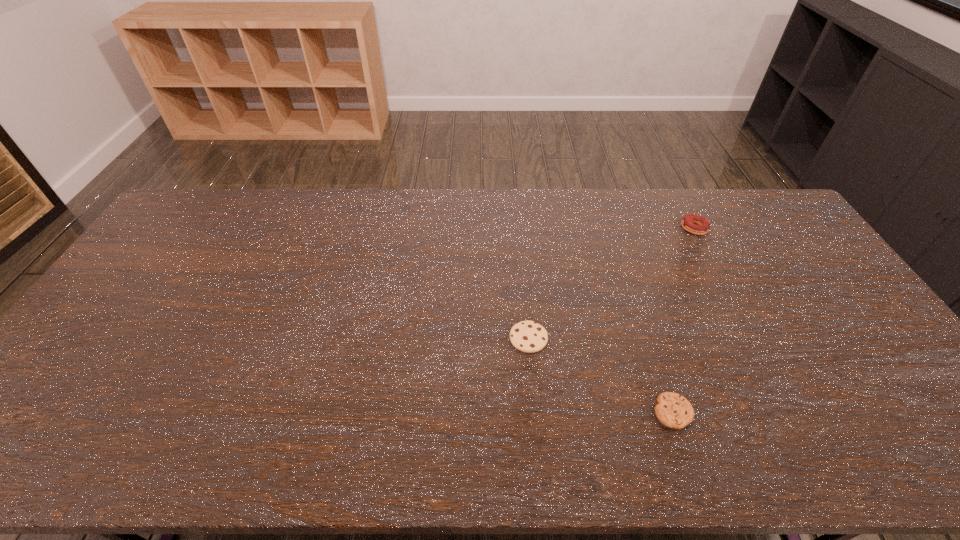
What are the coordinates of `free space between the farthest object and the nearer cookie` in the screenshot? It's located at (684, 320).

At what (x,y) coordinates should I click in order to perform the action: click on unoccupied area between the farther cookie and the right cookie. Please return your answer as a coordinate pair (x, y). The image size is (960, 540). Looking at the image, I should click on (601, 375).

This screenshot has height=540, width=960. Identify the location of free space between the farthest object and the shortest object. (684, 320).

This screenshot has height=540, width=960. I want to click on free space between the leftmost object and the second object from right to left, so click(601, 375).

This screenshot has height=540, width=960. What are the coordinates of `empty space between the rightmost object and the right cookie` in the screenshot? It's located at (684, 320).

Find the location of a particular element. The image size is (960, 540). object that is the second closest to the taller cookie is located at coordinates tap(689, 222).

Point out which object is positioned as the second nearest to the farthest object. Please provide its 2D coordinates. Your answer should be formatted as a tuple, i.e. [(x, y)], where the tuple contains the x and y coordinates of a point satisfying the conditions above.

[(527, 336)]

This screenshot has width=960, height=540. In order to click on vacant position in the image that satisfies the following two spatial constraints: 1. on the back side of the farther cookie; 2. on the right side of the farthest object in this screenshot , I will do `click(518, 228)`.

Find the location of a particular element. The height and width of the screenshot is (540, 960). vacant space that satisfies the following two spatial constraints: 1. on the back side of the doughnut; 2. on the right side of the farther cookie is located at coordinates (518, 228).

Locate an element on the screen. free space that satisfies the following two spatial constraints: 1. on the back side of the farthest object; 2. on the right side of the nearest object is located at coordinates (612, 228).